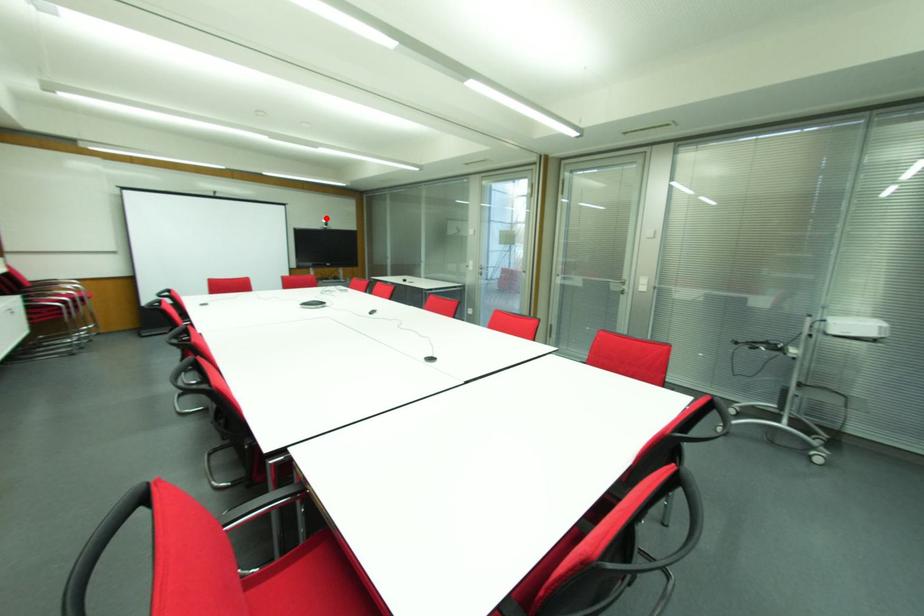
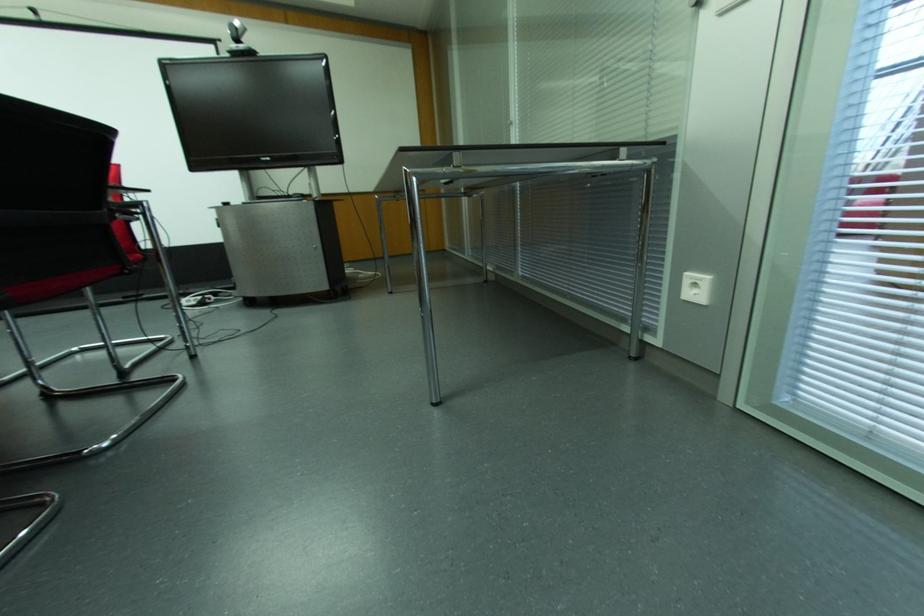
In the second image, find the point that corresponds to the highlighted location in the first image.

(237, 23)